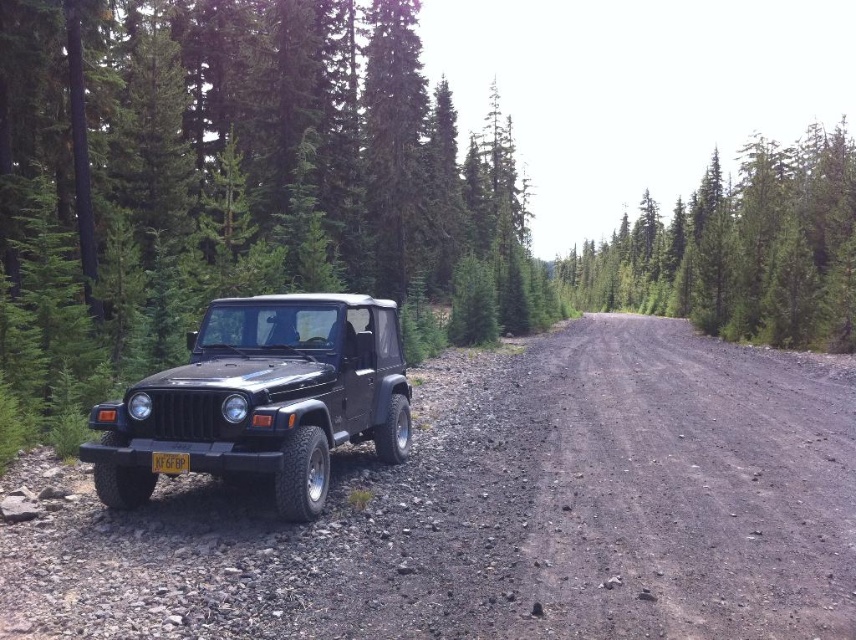
Question: Where is dirt/gravel road at center located in relation to matte black jeep at left in the image?

Choices:
 (A) above
 (B) below

Answer: (B)

Question: Which of these objects is positioned closest to the dirt/gravel road at center?

Choices:
 (A) matte black jeep at left
 (B) dusty gravel road at center
 (C) green textured pine trees at center
 (D) yellow matte license plate at center

Answer: (B)

Question: Is dusty gravel road at center behind green textured pine trees at center?

Choices:
 (A) no
 (B) yes

Answer: (A)

Question: Is dirt/gravel road at center thinner than green textured pine trees at center?

Choices:
 (A) no
 (B) yes

Answer: (B)

Question: Which of the following is the closest to the observer?

Choices:
 (A) dusty gravel road at center
 (B) dirt/gravel road at center
 (C) green textured pine trees at center

Answer: (B)

Question: Among these objects, which one is nearest to the camera?

Choices:
 (A) yellow matte license plate at center
 (B) dusty gravel road at center
 (C) dirt/gravel road at center

Answer: (C)